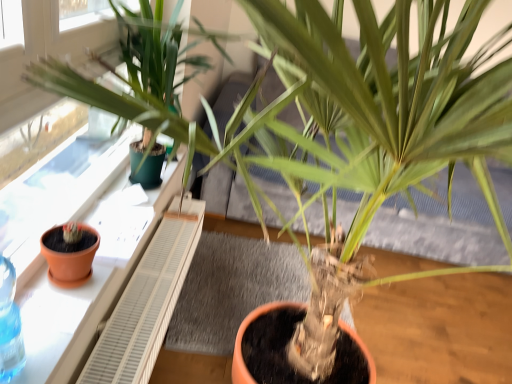
Identify the location of vacant space in front of terracotta clay pot at left. (51, 312).